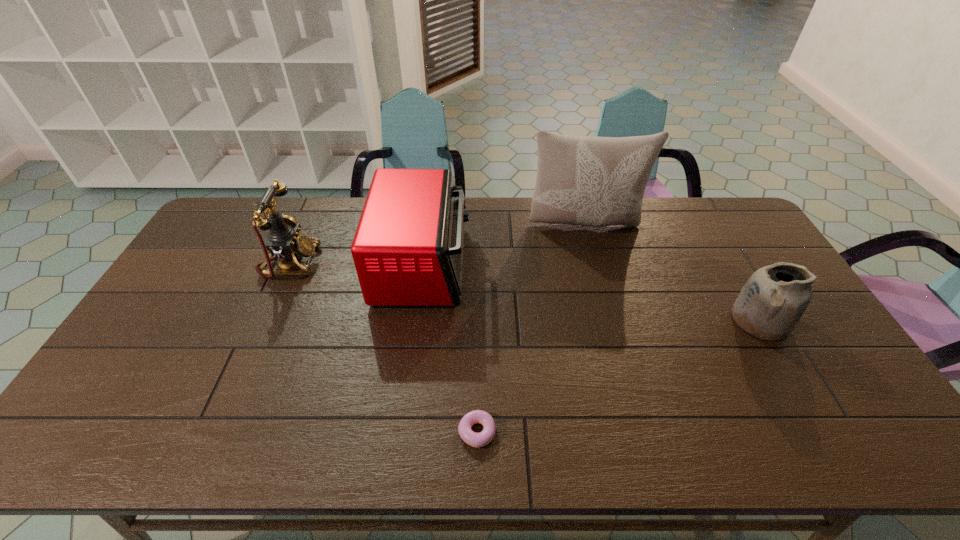
Find the location of a particular element. This screenshot has height=540, width=960. vacant region located on the front-facing side of the toaster oven is located at coordinates (540, 266).

Where is `free location located on the back of the pottery`? free location located on the back of the pottery is located at coordinates (712, 237).

The width and height of the screenshot is (960, 540). Find the location of `free space located on the back of the shortest object`. free space located on the back of the shortest object is located at coordinates (477, 369).

You are a GUI agent. You are given a task and a screenshot of the screen. Output one action in this format:
    pyautogui.click(x=<x>, y=<y>)
    Task: Click on the cushion present at the far edge
    This screenshot has width=960, height=540.
    Given the screenshot: What is the action you would take?
    [581, 180]

Locate an element on the screen. Image resolution: width=960 pixels, height=540 pixels. toaster oven present at the far edge is located at coordinates (408, 247).

Image resolution: width=960 pixels, height=540 pixels. What are the coordinates of `object that is at the near edge` in the screenshot? It's located at (474, 439).

Where is `object situated at the right edge`? object situated at the right edge is located at coordinates (773, 300).

Where is `vacant area at the far edge of the desktop`? The image size is (960, 540). vacant area at the far edge of the desktop is located at coordinates (656, 199).

Locate an element on the screen. This screenshot has height=540, width=960. vacant space at the near edge of the desktop is located at coordinates (567, 423).

The height and width of the screenshot is (540, 960). I want to click on vacant area at the left edge, so click(x=176, y=348).